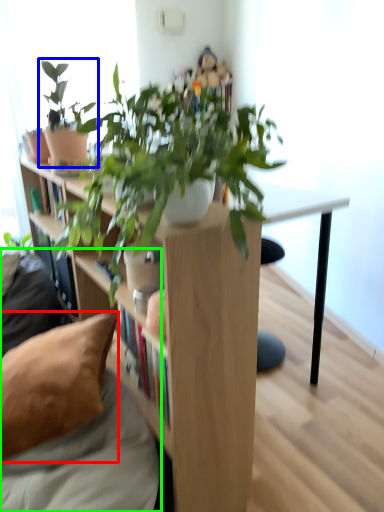
Question: Based on their relative distances, which object is farther from pillow (highlighted by a red box)? Choose from houseplant (highlighted by a blue box) and couch (highlighted by a green box).

Choices:
 (A) houseplant
 (B) couch

Answer: (A)